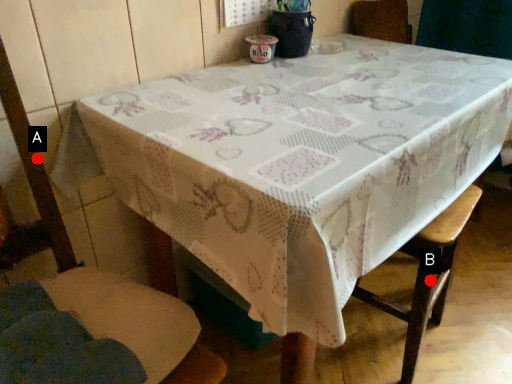
Question: Two points are circled on the image, labeled by A and B beside each circle. Which point is closer to the camera taking this photo?

Choices:
 (A) A is closer
 (B) B is closer

Answer: (A)